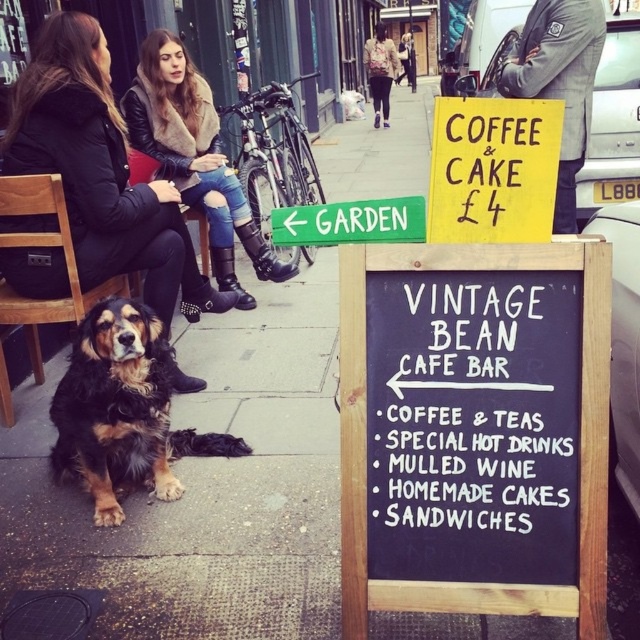
Measure the distance from black chalkboard at center to leather jacket at upper center.

black chalkboard at center is 40.96 feet from leather jacket at upper center.

At what (x,y) coordinates should I click in order to perform the action: click on black chalkboard at center. Please return your answer as a coordinate pair (x, y). The height and width of the screenshot is (640, 640). Looking at the image, I should click on (474, 429).

Identify the location of black chalkboard at center. The height and width of the screenshot is (640, 640). (474, 429).

Does point (512, 529) come closer to viewer compared to point (202, 170)?

Yes, point (512, 529) is in front of point (202, 170).

Which of these two, black chalkboard at center or leather jacket at upper left, stands shorter?

black chalkboard at center

Locate an element on the screen. This screenshot has width=640, height=640. black chalkboard at center is located at coordinates (474, 429).

Can you confirm if black chalkboard at center is wider than green wooden sign at lower left?

Indeed, black chalkboard at center has a greater width compared to green wooden sign at lower left.

Is black chalkboard at center to the left of green wooden sign at lower left from the viewer's perspective?

No, black chalkboard at center is not to the left of green wooden sign at lower left.

Is point (481, 355) positioned behind point (316, 218)?

No.

The image size is (640, 640). What are the coordinates of `black chalkboard at center` in the screenshot? It's located at (474, 429).